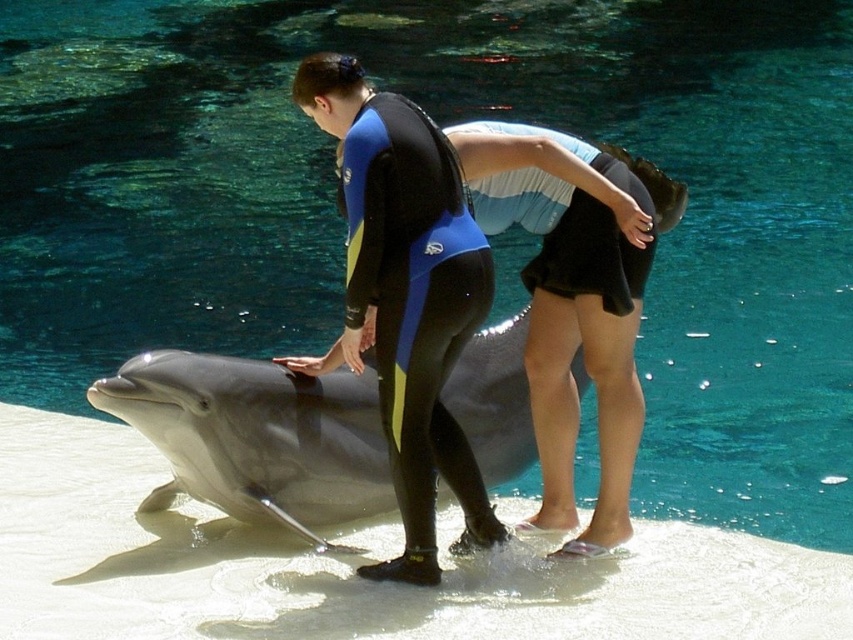
Question: Which object appears farthest from the camera in this image?

Choices:
 (A) black neoprene wetsuit at center
 (B) smooth gray dolphin at center

Answer: (B)

Question: Is smooth gray dolphin at center positioned before black neoprene wetsuit at center?

Choices:
 (A) no
 (B) yes

Answer: (A)

Question: In this image, where is smooth gray dolphin at center located relative to black neoprene wetsuit at center?

Choices:
 (A) right
 (B) left

Answer: (B)

Question: Which point is farther to the camera?

Choices:
 (A) smooth gray dolphin at center
 (B) black neoprene wetsuit at center

Answer: (A)

Question: Does smooth gray dolphin at center lie in front of black neoprene wetsuit at center?

Choices:
 (A) yes
 (B) no

Answer: (B)